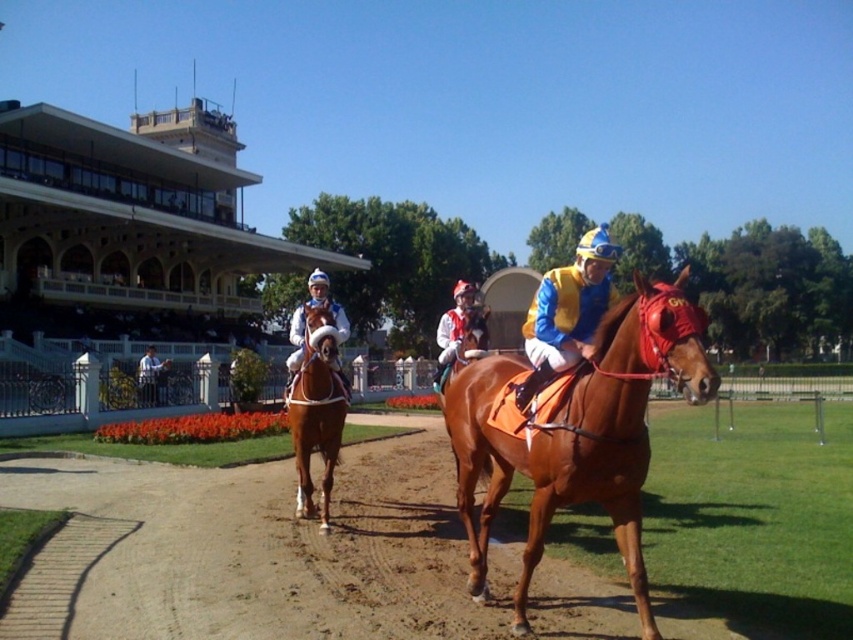
Which of these two, shiny brown horse at center or white jersey at center, stands shorter?

Standing shorter between the two is shiny brown horse at center.

From the picture: Can you confirm if shiny brown horse at center is positioned above white jersey at center?

No, shiny brown horse at center is not above white jersey at center.

Is point (329, 428) positioned behind point (444, 355)?

That is False.

The image size is (853, 640). I want to click on shiny brown horse at center, so click(x=317, y=406).

Looking at this image, who is lower down, white jersey at center or white fabric jacket at upper left?

white fabric jacket at upper left is below.

Which is more to the left, white jersey at center or white fabric jacket at upper left?

From the viewer's perspective, white fabric jacket at upper left appears more on the left side.

Measure the distance between white jersey at center and camera.

white jersey at center and camera are 8.39 meters apart.

Identify the location of white jersey at center. The height and width of the screenshot is (640, 853). (460, 333).

Does brown glossy horse at center have a smaller size compared to shiny brown horse at center?

No.

Looking at this image, does brown glossy horse at center have a greater height compared to shiny brown horse at center?

Yes, brown glossy horse at center is taller than shiny brown horse at center.

You are a GUI agent. You are given a task and a screenshot of the screen. Output one action in this format:
    pyautogui.click(x=<x>, y=<y>)
    Task: Click on the brown glossy horse at center
    This screenshot has height=640, width=853.
    Given the screenshot: What is the action you would take?
    pyautogui.click(x=576, y=433)

The width and height of the screenshot is (853, 640). I want to click on brown glossy horse at center, so [576, 433].